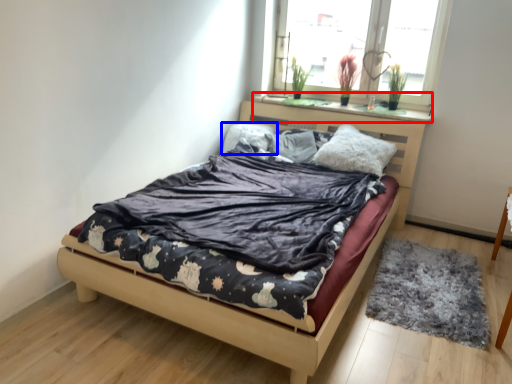
Question: Among these objects, which one is nearest to the camera, window sill (highlighted by a red box) or pillow (highlighted by a blue box)?

Choices:
 (A) window sill
 (B) pillow

Answer: (A)